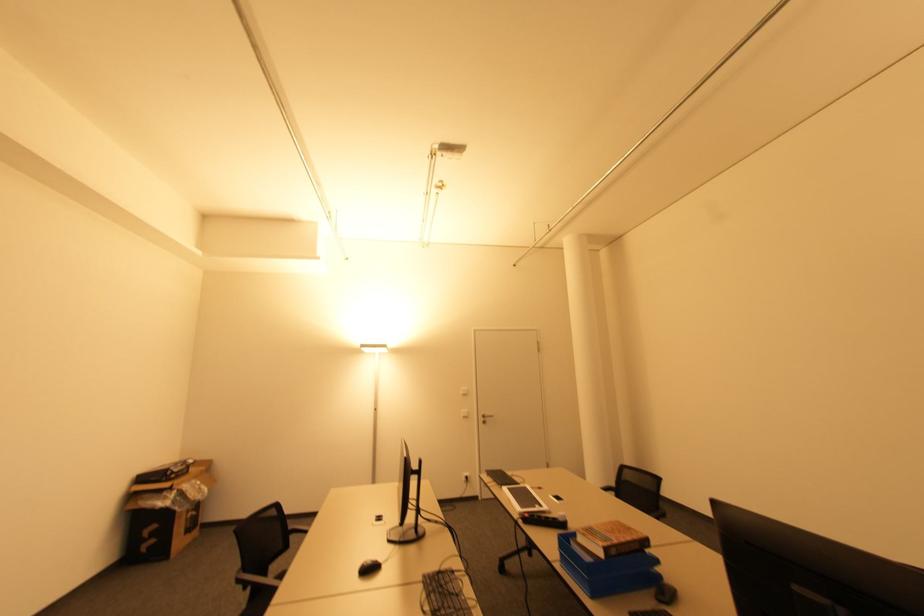
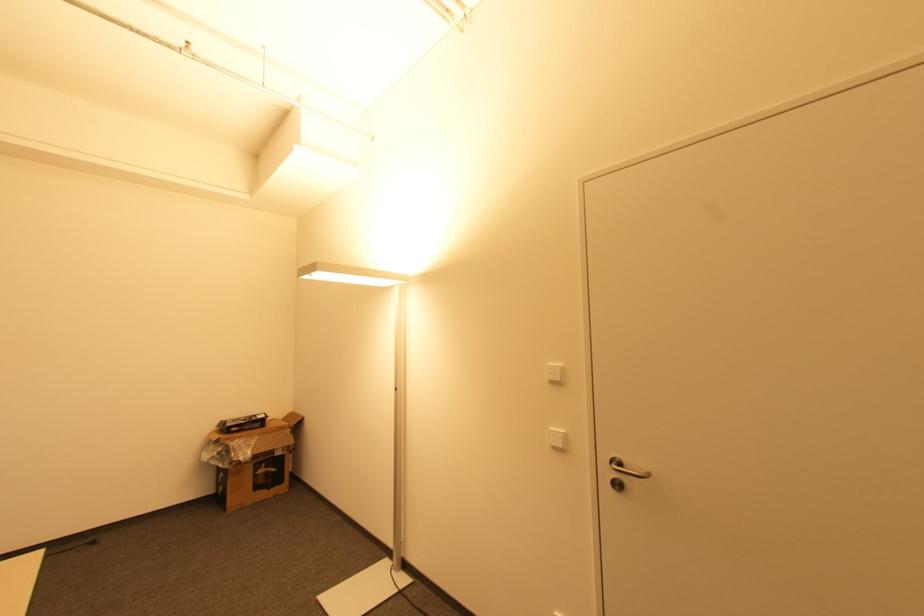
Locate, in the second image, the point that corresponds to the point at 195,516 in the first image.

(268, 472)